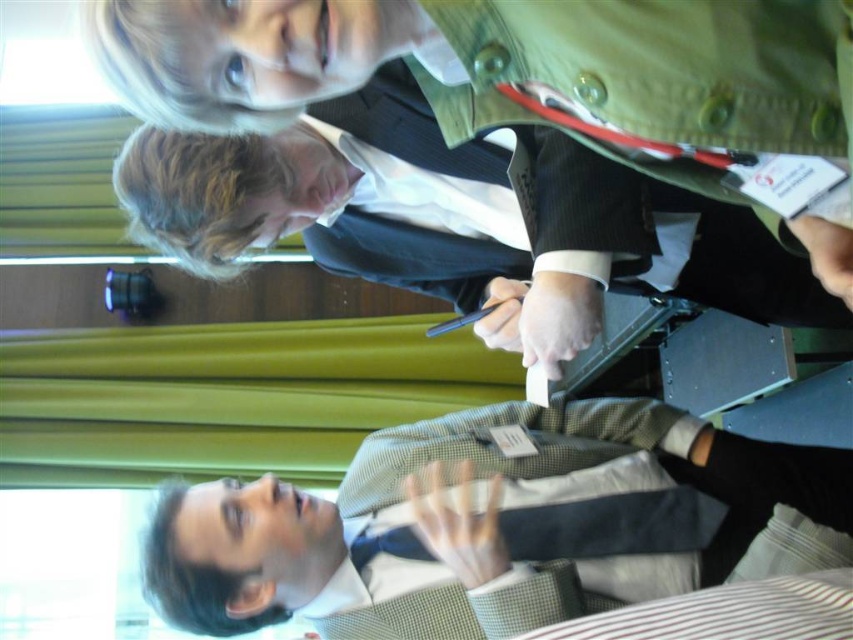
How much distance is there between checkered fabric shirt at lower center and dark green textured jacket at upper center?

13.77 inches

Between point (450, 532) and point (732, 301), which one is positioned behind?

The point (732, 301) is behind.

I want to click on checkered fabric shirt at lower center, so click(486, 524).